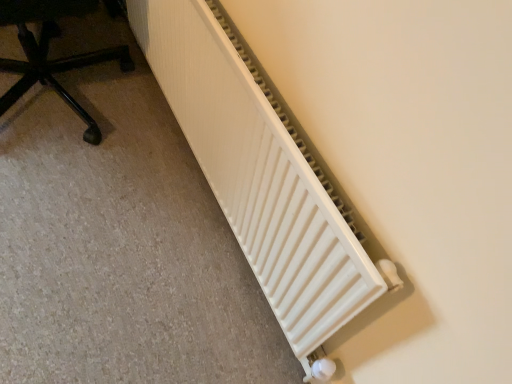
I want to click on white matte radiator at lower right, so tap(262, 176).

What do you see at coordinates (262, 176) in the screenshot? The width and height of the screenshot is (512, 384). I see `white matte radiator at lower right` at bounding box center [262, 176].

Locate an element on the screen. This screenshot has width=512, height=384. black plastic chair at lower left is located at coordinates (47, 53).

Describe the element at coordinates (47, 53) in the screenshot. I see `black plastic chair at lower left` at that location.

Locate an element on the screen. This screenshot has width=512, height=384. white matte radiator at lower right is located at coordinates (262, 176).

Considering the positions of objects black plastic chair at lower left and white matte radiator at lower right in the image provided, who is more to the right, black plastic chair at lower left or white matte radiator at lower right?

Positioned to the right is white matte radiator at lower right.

Based on the photo, does black plastic chair at lower left come behind white matte radiator at lower right?

Yes, black plastic chair at lower left is further from the viewer.

Is point (67, 9) farther from camera compared to point (254, 216)?

Yes.

From the image's perspective, would you say black plastic chair at lower left is positioned over white matte radiator at lower right?

Yes, from the image's perspective, black plastic chair at lower left is on top of white matte radiator at lower right.

Based on the photo, from a real-world perspective, which is physically below, black plastic chair at lower left or white matte radiator at lower right?

In real-world perspective, black plastic chair at lower left is lower.

Which of these two, black plastic chair at lower left or white matte radiator at lower right, is wider?

Wider between the two is black plastic chair at lower left.

Between black plastic chair at lower left and white matte radiator at lower right, which one has less height?

With less height is black plastic chair at lower left.

Considering the relative sizes of black plastic chair at lower left and white matte radiator at lower right in the image provided, is black plastic chair at lower left smaller than white matte radiator at lower right?

Actually, black plastic chair at lower left might be larger than white matte radiator at lower right.

Is white matte radiator at lower right a part of black plastic chair at lower left?

That's incorrect, white matte radiator at lower right is not inside black plastic chair at lower left.

Are black plastic chair at lower left and white matte radiator at lower right beside each other?

No, black plastic chair at lower left is not making contact with white matte radiator at lower right.

Is black plastic chair at lower left oriented away from white matte radiator at lower right?

No, black plastic chair at lower left's orientation is not away from white matte radiator at lower right.

The width and height of the screenshot is (512, 384). I want to click on radiator below the black plastic chair at lower left (from the image's perspective), so click(262, 176).

In the image, is white matte radiator at lower right on the left side or the right side of black plastic chair at lower left?

Clearly, white matte radiator at lower right is on the right of black plastic chair at lower left in the image.

Which object is closer to the camera taking this photo, white matte radiator at lower right or black plastic chair at lower left?

white matte radiator at lower right is closer to the camera.

Which is farther from the camera, (326,226) or (37,8)?

The point (37,8) is behind.

From the image's perspective, is white matte radiator at lower right positioned above or below black plastic chair at lower left?

From the image's perspective, white matte radiator at lower right appears below black plastic chair at lower left.

From a real-world perspective, relative to black plastic chair at lower left, is white matte radiator at lower right vertically above or below?

From a real-world perspective, white matte radiator at lower right is physically above black plastic chair at lower left.

Between white matte radiator at lower right and black plastic chair at lower left, which one has larger width?

black plastic chair at lower left is wider.

Consider the image. Considering the sizes of objects white matte radiator at lower right and black plastic chair at lower left in the image provided, who is taller, white matte radiator at lower right or black plastic chair at lower left?

white matte radiator at lower right.

Does white matte radiator at lower right have a smaller size compared to black plastic chair at lower left?

Correct, white matte radiator at lower right occupies less space than black plastic chair at lower left.

From the picture: Is white matte radiator at lower right surrounding black plastic chair at lower left?

No, black plastic chair at lower left is not surrounded by white matte radiator at lower right.

Would you say white matte radiator at lower right is a long distance from black plastic chair at lower left?

white matte radiator at lower right is near black plastic chair at lower left, not far away.

Does white matte radiator at lower right turn towards black plastic chair at lower left?

Yes, white matte radiator at lower right is aimed at black plastic chair at lower left.

What's the angular difference between white matte radiator at lower right and black plastic chair at lower left's facing directions?

The angular difference between white matte radiator at lower right and black plastic chair at lower left is 95.6 degrees.

Find the location of a particular element. furniture behind the white matte radiator at lower right is located at coordinates (47, 53).

Locate an element on the screen. This screenshot has width=512, height=384. radiator that appears below the black plastic chair at lower left (from the image's perspective) is located at coordinates (262, 176).

Locate an element on the screen. The height and width of the screenshot is (384, 512). radiator that appears in front of the black plastic chair at lower left is located at coordinates (262, 176).